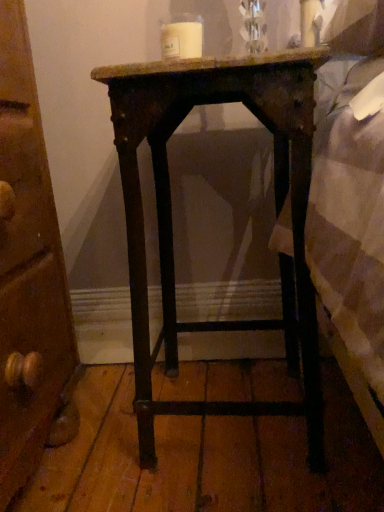
The width and height of the screenshot is (384, 512). Describe the element at coordinates (181, 40) in the screenshot. I see `white matte candle at upper center` at that location.

The image size is (384, 512). I want to click on white matte candle at upper center, so click(181, 40).

Find the location of a particular element. The image size is (384, 512). wooden nightstand at center is located at coordinates [x=171, y=216].

Describe the element at coordinates (171, 216) in the screenshot. The image size is (384, 512). I see `wooden nightstand at center` at that location.

In the scene shown: What is the approximate height of wooden nightstand at center?

The height of wooden nightstand at center is 29.14 inches.

Where is `white matte candle at upper center`? The width and height of the screenshot is (384, 512). white matte candle at upper center is located at coordinates (181, 40).

Does wooden nightstand at center appear on the left side of white matte candle at upper center?

No.

Is wooden nightstand at center closer to the viewer compared to white matte candle at upper center?

Yes, it is in front of white matte candle at upper center.

Which point is more distant from viewer, (285, 115) or (188, 27)?

Point (188, 27)

From the image's perspective, would you say wooden nightstand at center is positioned over white matte candle at upper center?

No, from the image's perspective, wooden nightstand at center is not over white matte candle at upper center.

From a real-world perspective, is wooden nightstand at center positioned over white matte candle at upper center based on gravity?

No, from a real-world perspective, wooden nightstand at center is not on top of white matte candle at upper center.

Based on the photo, is wooden nightstand at center wider than white matte candle at upper center?

Correct, the width of wooden nightstand at center exceeds that of white matte candle at upper center.

Who is taller, wooden nightstand at center or white matte candle at upper center?

Standing taller between the two is wooden nightstand at center.

Can you confirm if wooden nightstand at center is bigger than white matte candle at upper center?

Yes, wooden nightstand at center is bigger than white matte candle at upper center.

Is white matte candle at upper center located within wooden nightstand at center?

No, white matte candle at upper center is not inside wooden nightstand at center.

Is wooden nightstand at center next to white matte candle at upper center?

No, wooden nightstand at center is not in contact with white matte candle at upper center.

Is wooden nightstand at center oriented towards white matte candle at upper center?

No, wooden nightstand at center does not turn towards white matte candle at upper center.

At what (x,y) coordinates should I click in order to perform the action: click on nightstand that appears on the right of white matte candle at upper center. Please return your answer as a coordinate pair (x, y). Image resolution: width=384 pixels, height=512 pixels. Looking at the image, I should click on (171, 216).

Can you confirm if white matte candle at upper center is positioned to the left of wooden nightstand at center?

Indeed, white matte candle at upper center is positioned on the left side of wooden nightstand at center.

Is the position of white matte candle at upper center less distant than that of wooden nightstand at center?

No, the depth of white matte candle at upper center is greater than that of wooden nightstand at center.

Does point (187, 31) come closer to viewer compared to point (282, 120)?

No, (187, 31) is behind (282, 120).

From the image's perspective, which one is positioned lower, white matte candle at upper center or wooden nightstand at center?

wooden nightstand at center.

From a real-world perspective, is white matte candle at upper center over wooden nightstand at center?

Yes, from a real-world perspective, white matte candle at upper center is on top of wooden nightstand at center.

Does white matte candle at upper center have a greater width compared to wooden nightstand at center?

Incorrect, the width of white matte candle at upper center does not surpass that of wooden nightstand at center.

Does white matte candle at upper center have a greater height compared to wooden nightstand at center?

Incorrect, the height of white matte candle at upper center is not larger of that of wooden nightstand at center.

Based on their sizes in the image, would you say white matte candle at upper center is bigger or smaller than wooden nightstand at center?

Considering their sizes, white matte candle at upper center takes up less space than wooden nightstand at center.

Choose the correct answer: Is white matte candle at upper center inside wooden nightstand at center or outside it?

white matte candle at upper center is not enclosed by wooden nightstand at center.

Is white matte candle at upper center touching wooden nightstand at center?

No, white matte candle at upper center is not with wooden nightstand at center.

Is white matte candle at upper center looking in the opposite direction of wooden nightstand at center?

No.

How different are the orientations of white matte candle at upper center and wooden nightstand at center in degrees?

white matte candle at upper center and wooden nightstand at center are facing 1.04 degrees away from each other.

Measure the distance between white matte candle at upper center and wooden nightstand at center.

white matte candle at upper center and wooden nightstand at center are 14.63 inches apart.

Identify the location of nightstand located below the white matte candle at upper center (from the image's perspective). The height and width of the screenshot is (512, 384). (171, 216).

Where is `nightstand on the right of white matte candle at upper center`? nightstand on the right of white matte candle at upper center is located at coordinates (171, 216).

Image resolution: width=384 pixels, height=512 pixels. In order to click on candle that is on the left side of wooden nightstand at center in this screenshot , I will do coord(181,40).